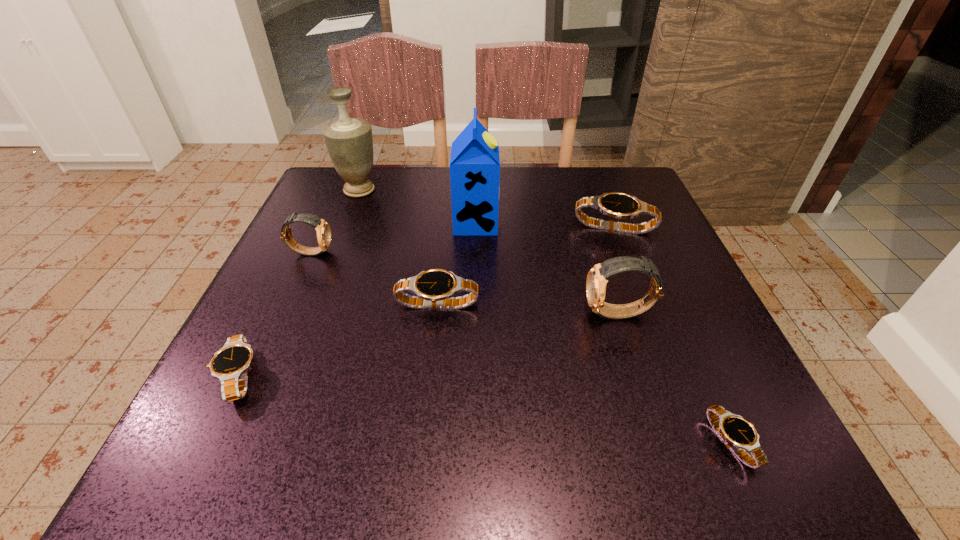
At what (x,y) coordinates should I click in order to perform the action: click on object at the far right corner. Please return your answer as a coordinate pair (x, y). The image size is (960, 540). Looking at the image, I should click on (618, 205).

This screenshot has width=960, height=540. What are the coordinates of `object situated at the near right corner` in the screenshot? It's located at (739, 434).

The height and width of the screenshot is (540, 960). I want to click on vacant space at the far edge of the desktop, so click(383, 201).

Locate an element on the screen. The width and height of the screenshot is (960, 540). blank space at the near edge of the desktop is located at coordinates (640, 423).

Where is `vacant space at the left edge of the desktop`? Image resolution: width=960 pixels, height=540 pixels. vacant space at the left edge of the desktop is located at coordinates (367, 224).

In the image, there is a desktop. Where is `free region at the right edge`? free region at the right edge is located at coordinates (656, 254).

Locate an element on the screen. The width and height of the screenshot is (960, 540). free region at the far left corner of the desktop is located at coordinates (309, 210).

The image size is (960, 540). What are the coordinates of `vacant space at the far right corner of the desktop` in the screenshot? It's located at (649, 200).

Locate an element on the screen. The image size is (960, 540). vacant space that is in between the shortest watch and the bigger gold watch is located at coordinates (675, 378).

The width and height of the screenshot is (960, 540). I want to click on empty location between the fifth shortest object and the biggest black watch, so click(463, 240).